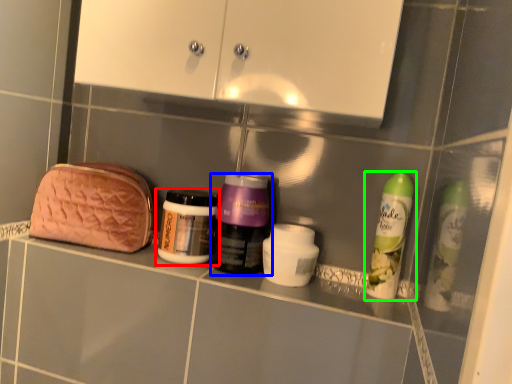
Question: Which is nearer to the bottle (highlighted by a red box)? bottle (highlighted by a blue box) or bottle (highlighted by a green box).

Choices:
 (A) bottle
 (B) bottle

Answer: (A)